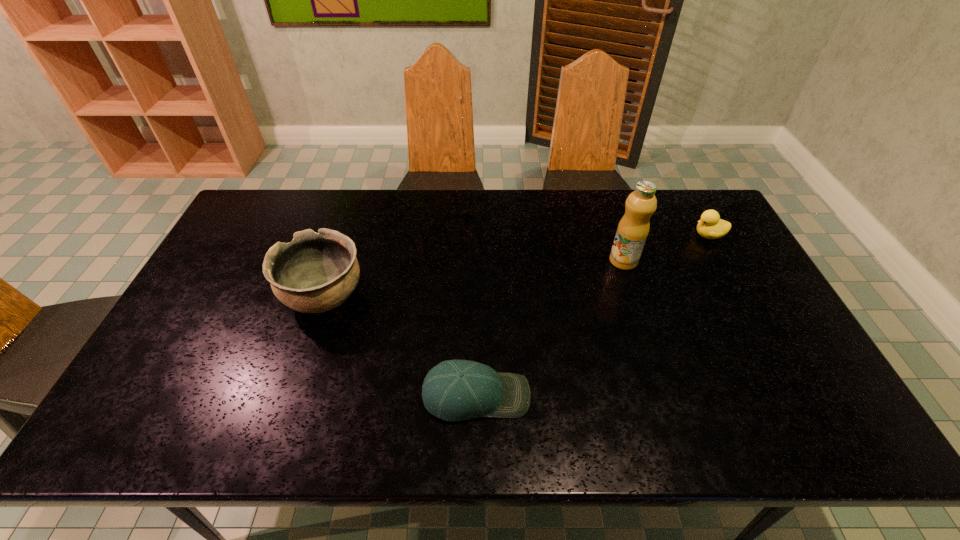
In order to click on the tallest object in this screenshot , I will do `click(633, 228)`.

This screenshot has height=540, width=960. What are the coordinates of `the third object from left to right` in the screenshot? It's located at (633, 228).

This screenshot has width=960, height=540. Identify the location of the leftmost object. (316, 272).

I want to click on pottery, so click(316, 272).

The height and width of the screenshot is (540, 960). I want to click on the farthest object, so click(710, 226).

Identify the location of the rightmost object. (710, 226).

Image resolution: width=960 pixels, height=540 pixels. In order to click on the nearest object in this screenshot , I will do `click(454, 390)`.

I want to click on baseball cap, so (x=454, y=390).

What are the coordinates of `free space located 0.100m on the front label of the fruit juice` in the screenshot? It's located at (635, 295).

This screenshot has height=540, width=960. Identify the location of vacant space located 0.130m on the right of the leftmost object. (411, 297).